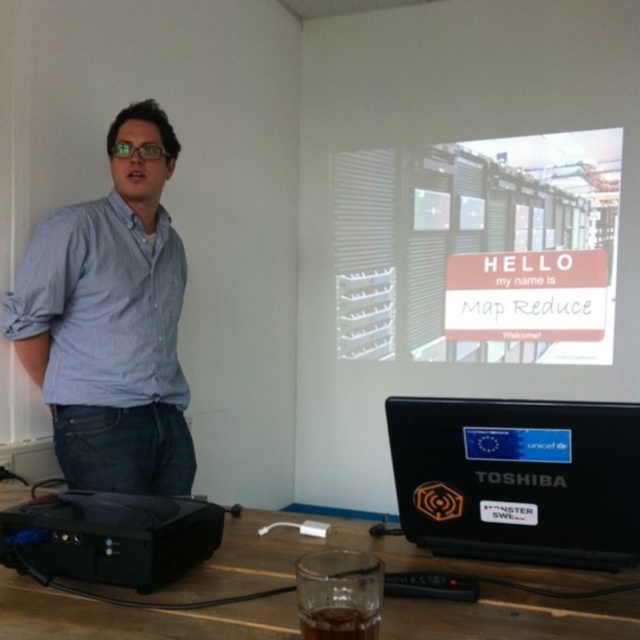
Question: Which of the following is the closest to the observer?

Choices:
 (A) blue denim jeans at left
 (B) brown glass at lower center

Answer: (B)

Question: Does white matte signboard at upper center appear on the left side of wooden table at lower center?

Choices:
 (A) yes
 (B) no

Answer: (B)

Question: Which of the following is the closest to the observer?

Choices:
 (A) black plastic projector at lower left
 (B) white matte signboard at upper center
 (C) blue denim jeans at left
 (D) wooden table at lower center

Answer: (D)

Question: Considering the real-world distances, which object is farthest from the wooden table at lower center?

Choices:
 (A) white matte signboard at upper center
 (B) transparent glass at lower center

Answer: (A)

Question: Can you confirm if white matte signboard at upper center is positioned above blue denim jeans at left?

Choices:
 (A) no
 (B) yes

Answer: (B)

Question: Does wooden table at lower center have a greater width compared to brown glass at lower center?

Choices:
 (A) no
 (B) yes

Answer: (B)